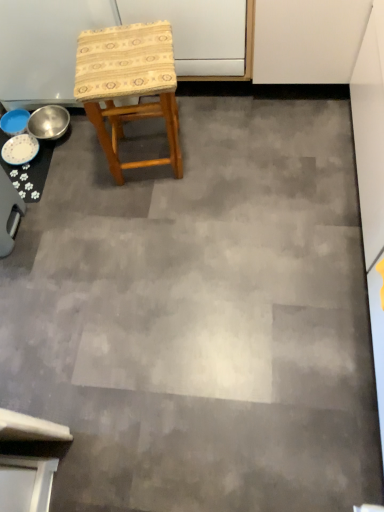
The height and width of the screenshot is (512, 384). What do you see at coordinates (49, 122) in the screenshot?
I see `metallic silver bowl at left` at bounding box center [49, 122].

Measure the distance between woven fabric stool at center and camera.

woven fabric stool at center is 4.01 feet away from camera.

What do you see at coordinates (128, 85) in the screenshot?
I see `woven fabric stool at center` at bounding box center [128, 85].

Image resolution: width=384 pixels, height=512 pixels. I want to click on white glossy plate at lower left, so click(20, 149).

Identify the location of blue glossy bowls at left. The width and height of the screenshot is (384, 512). (48, 123).

Is point (21, 159) closer or farther from the camera than point (48, 128)?

Point (21, 159) appears to be closer to the viewer than point (48, 128).

What are the coordinates of `plate on the left of metallic silver bowl at left` in the screenshot? It's located at (20, 149).

From the picture: Considering the sizes of objects white glossy plate at lower left and metallic silver bowl at left in the image provided, who is taller, white glossy plate at lower left or metallic silver bowl at left?

metallic silver bowl at left is taller.

From the image's perspective, which is above, white glossy plate at lower left or metallic silver bowl at left?

From the image's view, metallic silver bowl at left is above.

Is woven fabric stool at center to the right of white glossy plate at lower left from the viewer's perspective?

Yes.

How distant is woven fabric stool at center from white glossy plate at lower left?

The distance of woven fabric stool at center from white glossy plate at lower left is 19.86 inches.

Can you confirm if woven fabric stool at center is shorter than white glossy plate at lower left?

In fact, woven fabric stool at center may be taller than white glossy plate at lower left.

Can you tell me how much woven fabric stool at center and white glossy plate at lower left differ in facing direction?

The angle between the facing direction of woven fabric stool at center and the facing direction of white glossy plate at lower left is 81.4 degrees.

Is woven fabric stool at center located outside blue glossy bowls at left?

woven fabric stool at center is positioned outside blue glossy bowls at left.

How different are the orientations of woven fabric stool at center and blue glossy bowls at left in degrees?

They differ by 81.8 degrees in their facing directions.

Is woven fabric stool at center oriented away from blue glossy bowls at left?

No.

Measure the distance between woven fabric stool at center and blue glossy bowls at left.

A distance of 18.50 inches exists between woven fabric stool at center and blue glossy bowls at left.

Considering the sizes of objects blue glossy bowls at left and metallic silver bowl at left in the image provided, who is bigger, blue glossy bowls at left or metallic silver bowl at left?

metallic silver bowl at left is bigger.

From a real-world perspective, is blue glossy bowls at left physically below metallic silver bowl at left?

Correct, in the physical world, blue glossy bowls at left is lower than metallic silver bowl at left.

Can you see woven fabric stool at center touching metallic silver bowl at left?

No, woven fabric stool at center is not beside metallic silver bowl at left.

Which object is closer to the camera taking this photo, woven fabric stool at center or metallic silver bowl at left?

woven fabric stool at center is closer to the camera.

From a real-world perspective, is woven fabric stool at center beneath metallic silver bowl at left?

No, from a real-world perspective, woven fabric stool at center is not under metallic silver bowl at left.

Between blue glossy bowls at left and woven fabric stool at center, which one has less height?

Standing shorter between the two is blue glossy bowls at left.

How different are the orientations of blue glossy bowls at left and woven fabric stool at center in degrees?

81.8 degrees separate the facing orientations of blue glossy bowls at left and woven fabric stool at center.

From the image's perspective, would you say blue glossy bowls at left is shown under woven fabric stool at center?

Yes, from the image's perspective, blue glossy bowls at left is below woven fabric stool at center.

From the image's perspective, is blue glossy bowls at left above white glossy plate at lower left?

Incorrect, from the image's perspective, blue glossy bowls at left is lower than white glossy plate at lower left.

This screenshot has height=512, width=384. What are the coordinates of `plate behind the blue glossy bowls at left` in the screenshot? It's located at (20, 149).

Is blue glossy bowls at left aimed at white glossy plate at lower left?

Yes, blue glossy bowls at left is facing white glossy plate at lower left.

The width and height of the screenshot is (384, 512). What are the coordinates of `plate below the metallic silver bowl at left (from the image's perspective)` in the screenshot? It's located at (20, 149).

The width and height of the screenshot is (384, 512). I want to click on plate behind the woven fabric stool at center, so click(x=20, y=149).

From the picture: Based on their spatial positions, is woven fabric stool at center or blue glossy bowls at left further from metallic silver bowl at left?

woven fabric stool at center is positioned further to the anchor metallic silver bowl at left.

When comparing their distances from blue glossy bowls at left, does white glossy plate at lower left or woven fabric stool at center seem further?

Based on the image, woven fabric stool at center appears to be further to blue glossy bowls at left.

Looking at the image, which one is located closer to woven fabric stool at center, white glossy plate at lower left or blue glossy bowls at left?

blue glossy bowls at left.

Looking at the image, which one is located closer to blue glossy bowls at left, woven fabric stool at center or white glossy plate at lower left?

white glossy plate at lower left.

Which object lies further to the anchor point blue glossy bowls at left, metallic silver bowl at left or woven fabric stool at center?

Based on the image, woven fabric stool at center appears to be further to blue glossy bowls at left.

Estimate the real-world distances between objects in this image. Which object is further from blue glossy bowls at left, metallic silver bowl at left or white glossy plate at lower left?

metallic silver bowl at left.

From the image, which object appears to be farther from blue glossy bowls at left, woven fabric stool at center or metallic silver bowl at left?

woven fabric stool at center.

When comparing their distances from woven fabric stool at center, does metallic silver bowl at left or blue glossy bowls at left seem closer?

blue glossy bowls at left.

Where is `plate located between blue glossy bowls at left and woven fabric stool at center in the left-right direction`? plate located between blue glossy bowls at left and woven fabric stool at center in the left-right direction is located at coordinates (20, 149).

At what (x,y) coordinates should I click in order to perform the action: click on bowl between blue glossy bowls at left and woven fabric stool at center. Please return your answer as a coordinate pair (x, y). Image resolution: width=384 pixels, height=512 pixels. Looking at the image, I should click on (49, 122).

This screenshot has width=384, height=512. I want to click on plate located between blue glossy bowls at left and metallic silver bowl at left in the left-right direction, so click(20, 149).

Image resolution: width=384 pixels, height=512 pixels. Find the location of `bowl between white glossy plate at lower left and woven fabric stool at center in the horizontal direction`. bowl between white glossy plate at lower left and woven fabric stool at center in the horizontal direction is located at coordinates (49, 122).